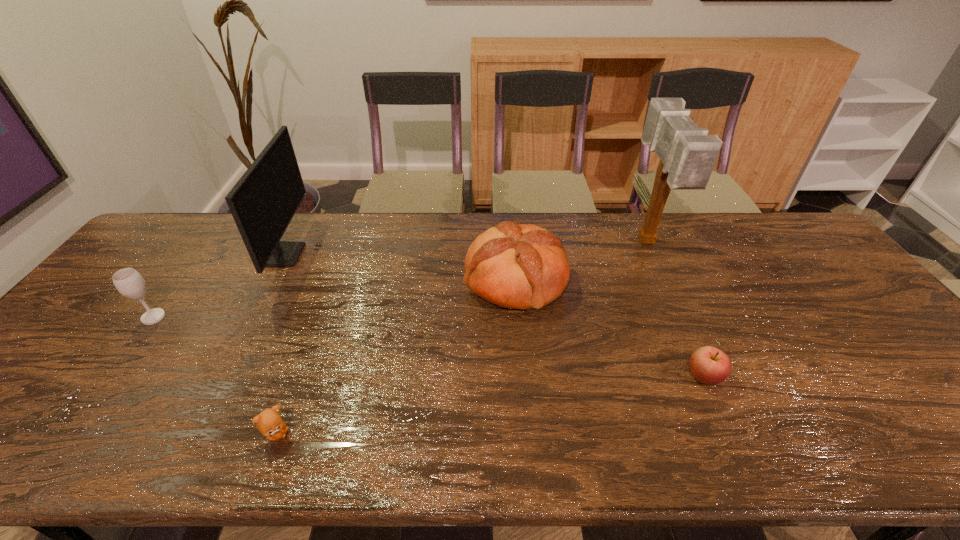
Locate an element on the screen. The width and height of the screenshot is (960, 540). vacant space located 0.130m on the front of the bread is located at coordinates (522, 356).

This screenshot has width=960, height=540. I want to click on vacant area situated 0.350m on the right of the leftmost object, so click(295, 317).

Identify the location of vacant space situated 0.320m on the back of the apple. (658, 274).

You are a GUI agent. You are given a task and a screenshot of the screen. Output one action in this format:
    pyautogui.click(x=<x>, y=<y>)
    Task: Click on the vacant space located 0.200m on the face of the nearest object
    The height and width of the screenshot is (540, 960).
    Given the screenshot: What is the action you would take?
    pyautogui.click(x=382, y=434)

The height and width of the screenshot is (540, 960). In order to click on mallet situated at the far edge in this screenshot , I will do `click(687, 154)`.

Where is `computer monitor located at the far edge`? The height and width of the screenshot is (540, 960). computer monitor located at the far edge is located at coordinates (264, 200).

Find the location of a particular element. The width and height of the screenshot is (960, 540). bread situated at the far edge is located at coordinates (524, 266).

Where is `object at the near edge`? This screenshot has height=540, width=960. object at the near edge is located at coordinates (269, 422).

At what (x,y) coordinates should I click in order to perform the action: click on free point at the far edge. Please return your answer as a coordinate pair (x, y). Looking at the image, I should click on (487, 221).

Image resolution: width=960 pixels, height=540 pixels. Identify the location of blank space at the near edge of the desktop. (430, 438).